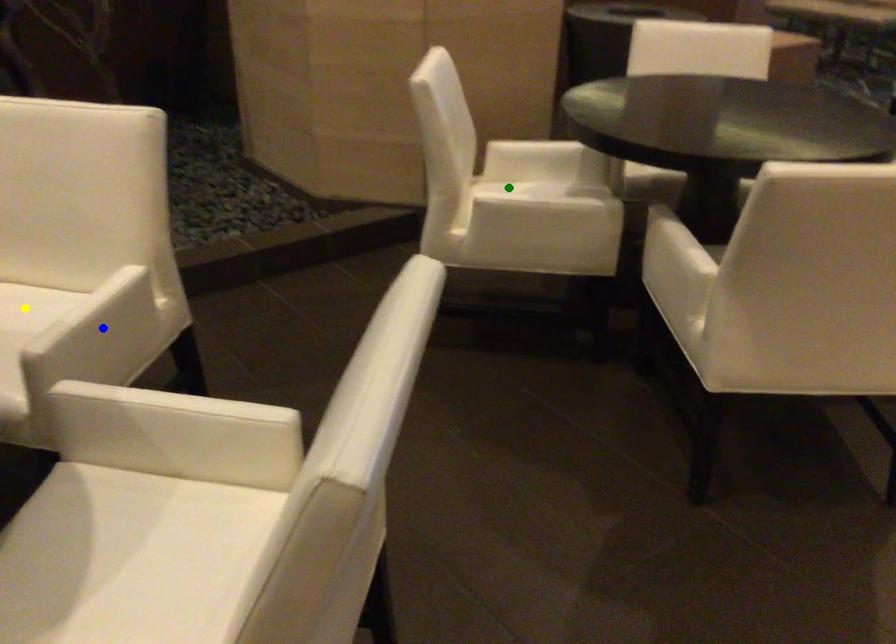
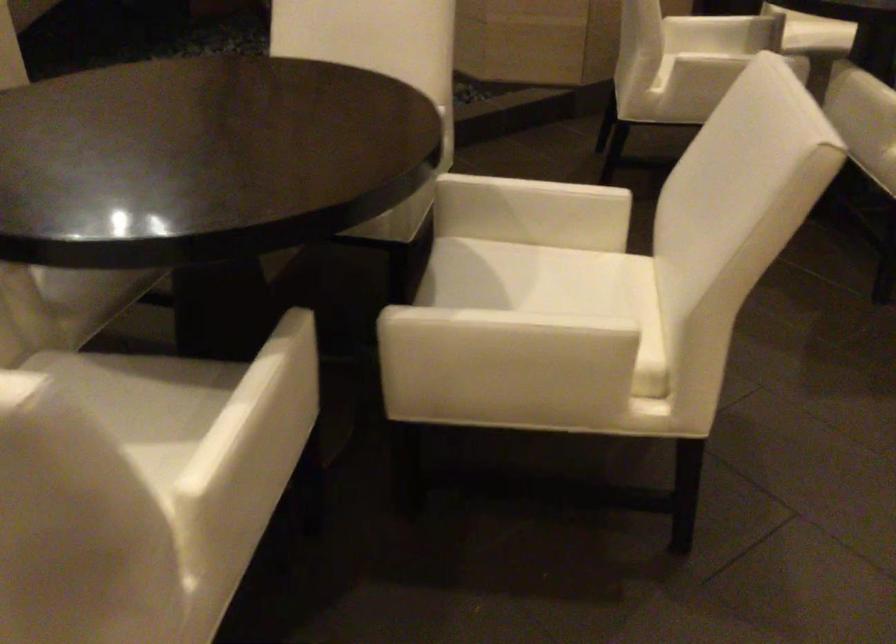
I am providing you with two images of the same scene from different viewpoints. Three points are marked in image1. Which point corresponds to a part or object that is occluded in image2?In image1, three points are marked. Which of them correspond to a part or object that is occluded in image2?Among the three points shown in image1, which one corresponds to a part or object that is no longer visible due to occlusion in image2?

yellow point, blue point cannot be seen in image2.